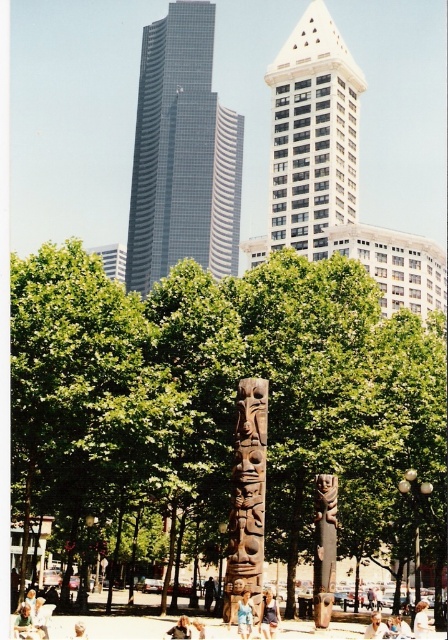
You are a photographer trying to capture both the dark brown wood totem pole at center and the blue denim shorts at lower center in the same frame. Since you want to emphasize the totem pole, which object should you focus on first and why?

You should focus on the dark brown wood totem pole at center first because it is larger in size than the blue denim shorts at lower center, making it the more prominent subject in the scene.

You are standing at the entrance of the park and want to locate the dark brown wood totem pole at center. According to the coordinates provided, where should you look to find it?

The dark brown wood totem pole at center is located at coordinates point (246, 497), which means you should look towards the upper right area of the park entrance to find it.

You are a photographer standing in front of the dark brown wood totem pole at center and the blonde hair person at center. You want to take a photo that includes both subjects. Which subject should you focus on first to ensure both are in the frame?

You should focus on the dark brown wood totem pole at center first because it is closer to you than the blonde hair person at center, ensuring both are in the frame.